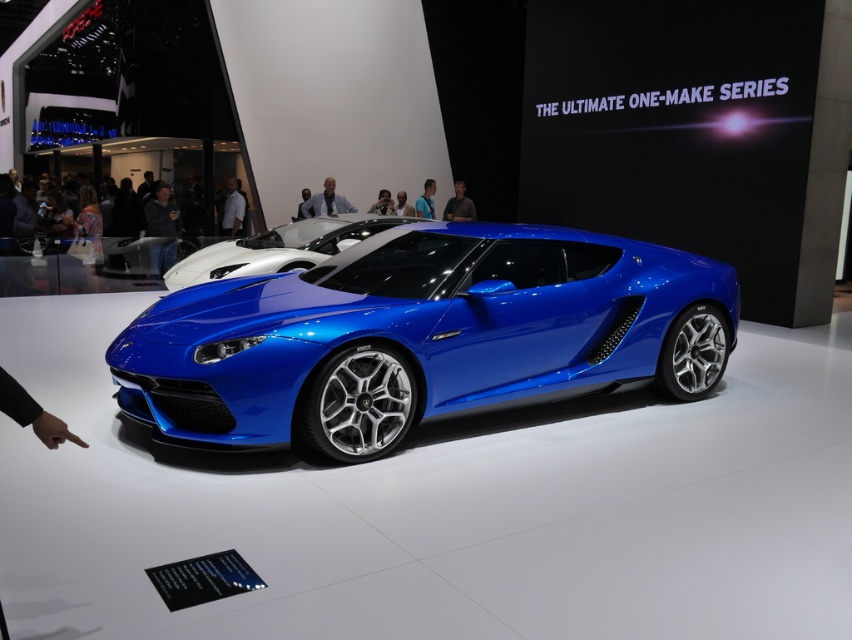
Does light blue shirt at center have a smaller size compared to white smooth shirt at center?

No.

Between light blue shirt at center and white smooth shirt at center, which one appears on the right side from the viewer's perspective?

Positioned to the right is light blue shirt at center.

Does point (326, 211) come closer to viewer compared to point (235, 179)?

Yes, point (326, 211) is in front of point (235, 179).

This screenshot has height=640, width=852. I want to click on light blue shirt at center, so click(x=326, y=202).

Which of these two, shiny blue sports car at center or shiny blue car at center, stands taller?

shiny blue sports car at center is taller.

Can you confirm if shiny blue sports car at center is positioned below shiny blue car at center?

Yes, shiny blue sports car at center is below shiny blue car at center.

Is point (372, 323) positioned before point (400, 220)?

Yes, point (372, 323) is closer to viewer.

This screenshot has height=640, width=852. Identify the location of shiny blue sports car at center. (421, 336).

Who is higher up, shiny blue car at center or dark gray shirt at center?

Positioned higher is dark gray shirt at center.

Looking at this image, which of these two, shiny blue car at center or dark gray shirt at center, stands shorter?

Standing shorter between the two is dark gray shirt at center.

Is point (327, 221) positioned before point (446, 209)?

That is True.

Locate an element on the screen. shiny blue car at center is located at coordinates (275, 248).